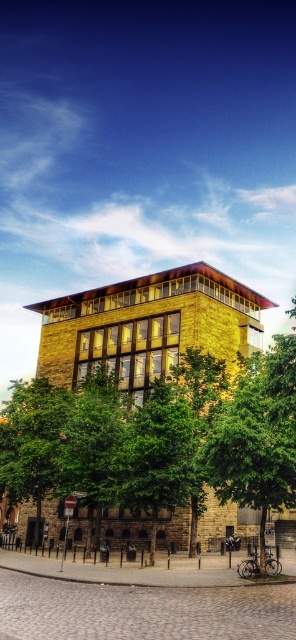
Between green leafy tree at center and green leafy tree at lower left, which one is positioned higher?

green leafy tree at center

Which is more to the right, green leafy tree at center or green leafy tree at lower left?

From the viewer's perspective, green leafy tree at center appears more on the right side.

Who is more forward, (174, 449) or (24, 445)?

Point (174, 449) is in front.

The width and height of the screenshot is (296, 640). Identify the location of green leafy tree at center. (158, 456).